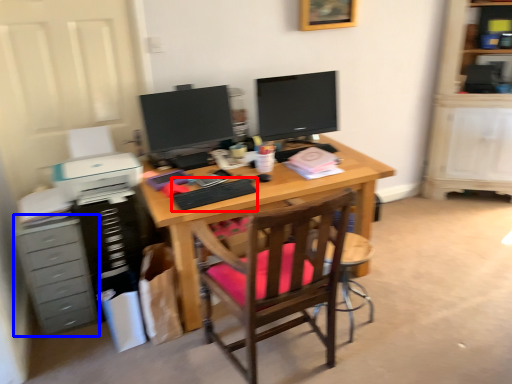
Question: Which of the following is the closest to the observer, computer keyboard (highlighted by a red box) or chest of drawers (highlighted by a blue box)?

Choices:
 (A) computer keyboard
 (B) chest of drawers

Answer: (A)